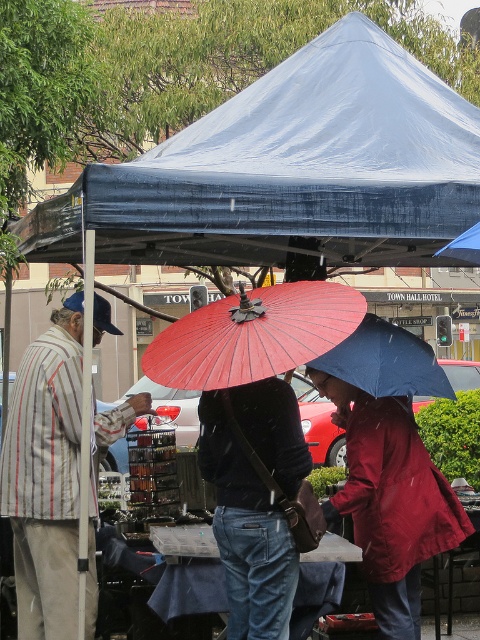
Question: Which is farther from the denim jeans at center?

Choices:
 (A) red paper umbrella at center
 (B) matte blue umbrella at center
 (C) matte red coat at lower right
 (D) white matte canopy at upper center

Answer: (D)

Question: Is red paper umbrella at center positioned behind matte blue umbrella at center?

Choices:
 (A) yes
 (B) no

Answer: (B)

Question: Which object is farther from the camera taking this photo?

Choices:
 (A) matte blue umbrella at center
 (B) denim jeans at center

Answer: (A)

Question: In this image, where is denim jeans at center located relative to matte blue umbrella at center?

Choices:
 (A) below
 (B) above

Answer: (A)

Question: Which object is closer to the camera taking this photo?

Choices:
 (A) white matte canopy at upper center
 (B) denim jeans at center
 (C) striped fabric jacket at left
 (D) red paper umbrella at center

Answer: (B)

Question: Is white matte canopy at upper center closer to the viewer compared to matte blue umbrella at center?

Choices:
 (A) yes
 (B) no

Answer: (B)